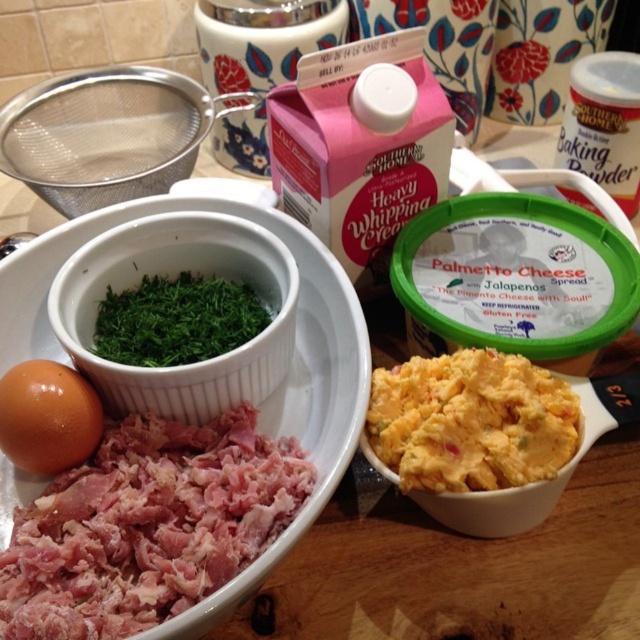
You are a chef preparing a dish and need to place a new ingredient on the wooden surface. The new ingredient must be placed exactly at the coordinates of the pinkish raw meat at lower left. What are the coordinates where you should place the new ingredient?

The coordinates for the pinkish raw meat at lower left are at point (147,525), so you should place the new ingredient at those coordinates.